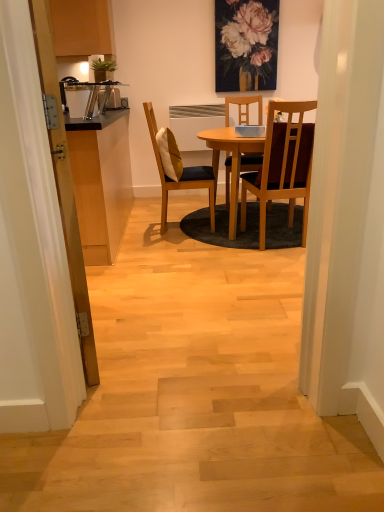
Question: Does wooden cabinet at left appear on the left side of matte floral painting at upper center?

Choices:
 (A) no
 (B) yes

Answer: (B)

Question: Is there a large distance between wooden cabinet at left and matte floral painting at upper center?

Choices:
 (A) no
 (B) yes

Answer: (B)

Question: Is the surface of wooden cabinet at left in direct contact with matte floral painting at upper center?

Choices:
 (A) yes
 (B) no

Answer: (B)

Question: From the image's perspective, is wooden cabinet at left located above matte floral painting at upper center?

Choices:
 (A) no
 (B) yes

Answer: (A)

Question: Is wooden cabinet at left at the right side of matte floral painting at upper center?

Choices:
 (A) yes
 (B) no

Answer: (B)

Question: Is wooden cabinet at left oriented towards matte floral painting at upper center?

Choices:
 (A) yes
 (B) no

Answer: (B)

Question: Does wooden door at left have a smaller size compared to matte floral painting at upper center?

Choices:
 (A) yes
 (B) no

Answer: (B)

Question: From a real-world perspective, does wooden door at left sit lower than matte floral painting at upper center?

Choices:
 (A) yes
 (B) no

Answer: (A)

Question: Is wooden door at left in front of matte floral painting at upper center?

Choices:
 (A) yes
 (B) no

Answer: (A)

Question: Is the surface of wooden door at left in direct contact with matte floral painting at upper center?

Choices:
 (A) no
 (B) yes

Answer: (A)

Question: Considering the relative sizes of wooden door at left and matte floral painting at upper center in the image provided, is wooden door at left bigger than matte floral painting at upper center?

Choices:
 (A) yes
 (B) no

Answer: (A)

Question: Is matte floral painting at upper center completely or partially inside wooden door at left?

Choices:
 (A) yes
 (B) no

Answer: (B)

Question: Does soft yellow cushion at center have a greater height compared to wooden cabinet at left?

Choices:
 (A) yes
 (B) no

Answer: (B)